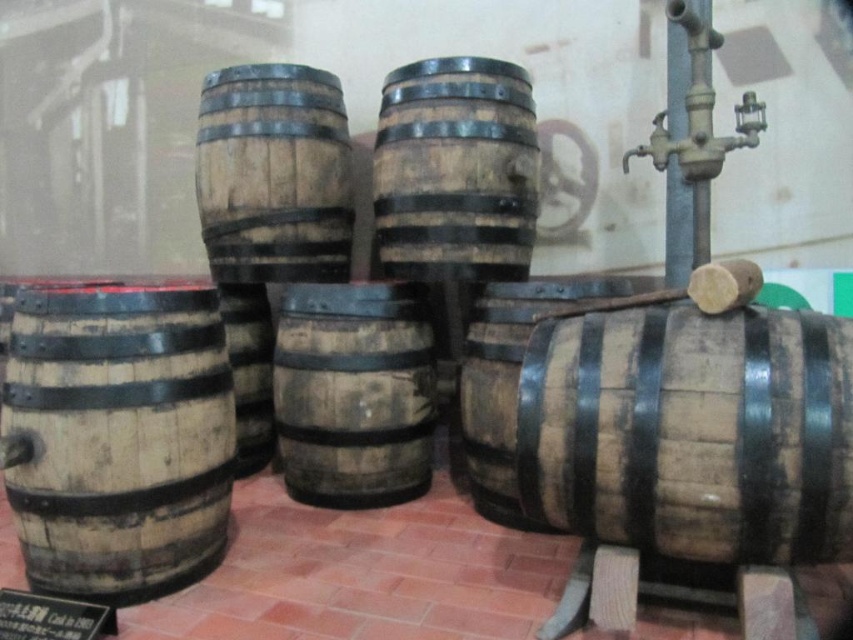
Question: Which object is positioned closest to the weathered wood barrel at center?

Choices:
 (A) dark brown wood barrel at center
 (B) wooden barrel at left
 (C) wooden barrel at center

Answer: (C)

Question: Which object is positioned farthest from the weathered wood barrel at center?

Choices:
 (A) wooden barrel at left
 (B) brown wooden barrel at lower right
 (C) dark brown wood barrel at center
 (D) wooden barrel at center

Answer: (A)

Question: Does brown wooden barrel at lower right have a smaller size compared to weathered wood barrel at center?

Choices:
 (A) yes
 (B) no

Answer: (B)

Question: Which point is farther to the camera?

Choices:
 (A) (399, 67)
 (B) (314, 465)
 (C) (167, 401)
 (D) (538, 499)

Answer: (A)

Question: Can you confirm if weathered wood barrel at center is bigger than dark brown wood barrel at center?

Choices:
 (A) yes
 (B) no

Answer: (B)

Question: Does brown wooden barrel at lower right appear on the left side of wooden barrel at center?

Choices:
 (A) yes
 (B) no

Answer: (B)